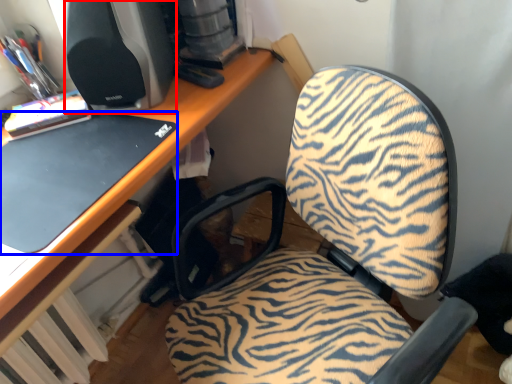
Question: Which point is further to the camera, desktop computer (highlighted by a red box) or laptop (highlighted by a blue box)?

Choices:
 (A) desktop computer
 (B) laptop

Answer: (A)